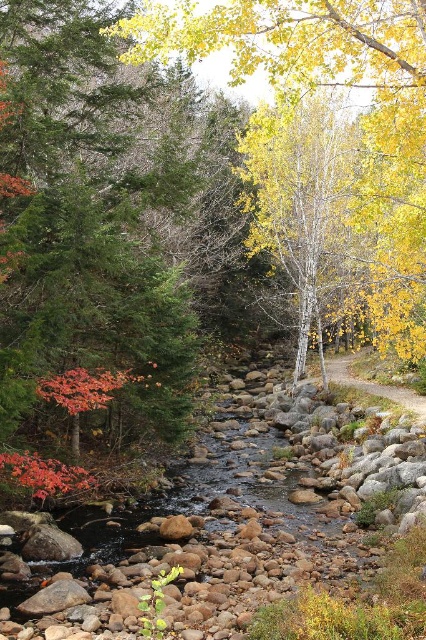
Question: Is smooth white birch at center to the right of brown dirt path at center-right from the viewer's perspective?

Choices:
 (A) yes
 (B) no

Answer: (B)

Question: Which object is closer to the camera taking this photo?

Choices:
 (A) brown dirt path at center-right
 (B) smooth white birch at center

Answer: (A)

Question: Can you confirm if smooth white birch at center is positioned to the left of brown dirt path at center-right?

Choices:
 (A) yes
 (B) no

Answer: (A)

Question: Among these objects, which one is farthest from the camera?

Choices:
 (A) brown dirt path at center-right
 (B) smooth white birch at center

Answer: (B)

Question: Which point is farther to the camera?

Choices:
 (A) (347, 365)
 (B) (301, 237)

Answer: (B)

Question: Is smooth white birch at center to the left of brown dirt path at center-right from the viewer's perspective?

Choices:
 (A) yes
 (B) no

Answer: (A)